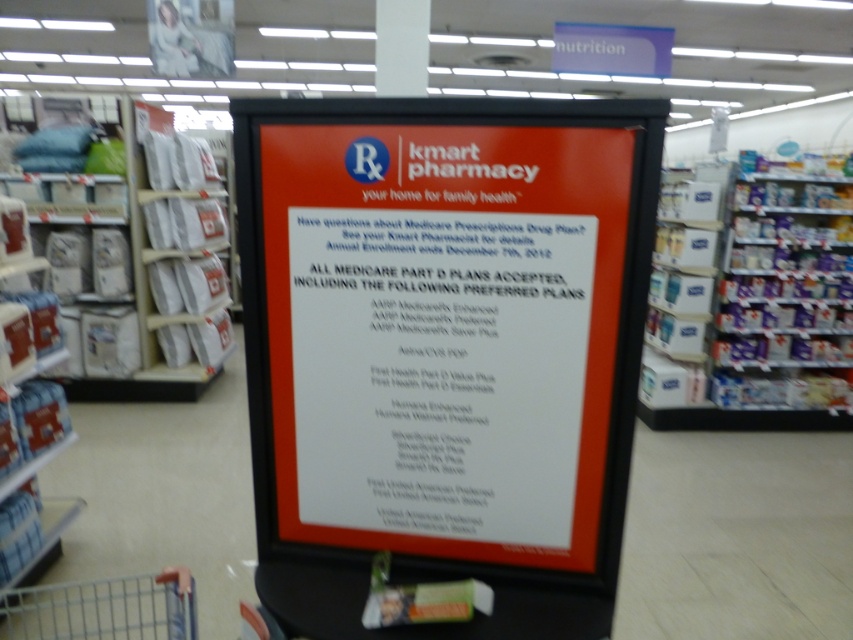
You are a customer entering the Kmart pharmacy section. You see the matte plastic sign at center and the metallic silver shopping cart at lower left. Which object is bigger?

The matte plastic sign at center is larger than the metallic silver shopping cart at lower left.

You are standing in the Kmart pharmacy section and want to reach a point that is 1.23 meters away from you. Can you walk directly to the point at coordinate point [503,545]?

The point at coordinate point [503,545] is 1.23 meters away from the viewer, so yes, you can walk directly to the point at coordinate point [503,545] since it is within a reachable distance.